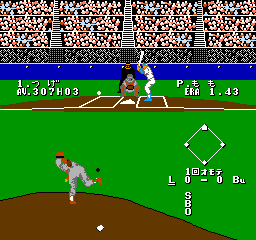
Where is `fans in stand in middle sections`? The width and height of the screenshot is (256, 240). fans in stand in middle sections is located at coordinates [x=101, y=37], [x=160, y=34].